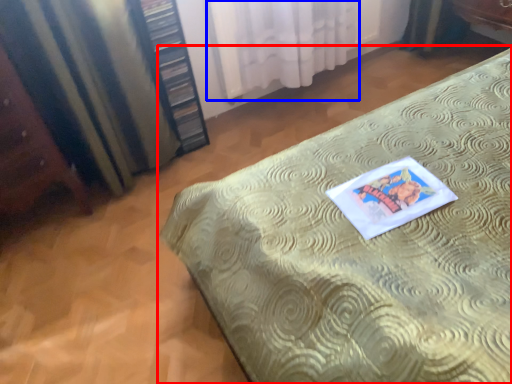
Question: Which of the following is the closest to the observer, bed (highlighted by a red box) or curtain (highlighted by a blue box)?

Choices:
 (A) bed
 (B) curtain

Answer: (A)